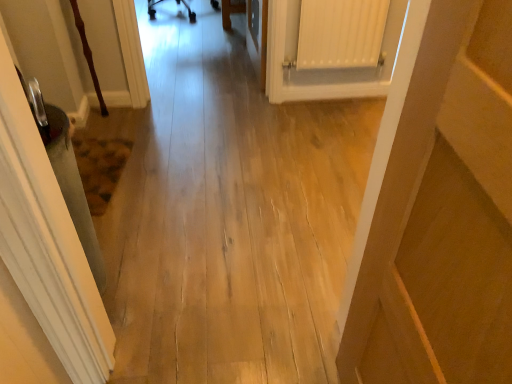
Question: Considering the relative positions of light wood floor at center and white matte radiator at upper right in the image provided, is light wood floor at center to the left or to the right of white matte radiator at upper right?

Choices:
 (A) right
 (B) left

Answer: (B)

Question: Is light wood floor at center wider or thinner than white matte radiator at upper right?

Choices:
 (A) wide
 (B) thin

Answer: (A)

Question: Which object is the farthest from the white matte radiator at upper right?

Choices:
 (A) wooden door at right
 (B) light wood floor at center

Answer: (A)

Question: Which object is the closest to the white matte radiator at upper right?

Choices:
 (A) light wood floor at center
 (B) wooden door at right

Answer: (A)